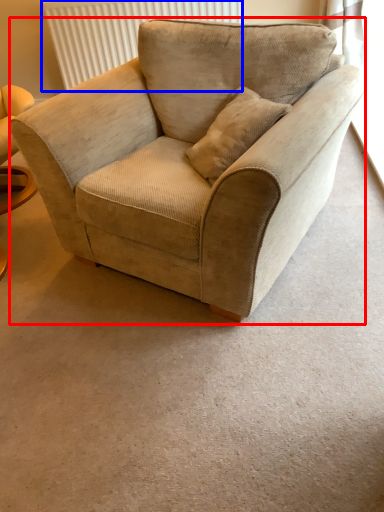
Question: Which point is further to the camera, chair (highlighted by a red box) or radiator (highlighted by a blue box)?

Choices:
 (A) chair
 (B) radiator

Answer: (B)